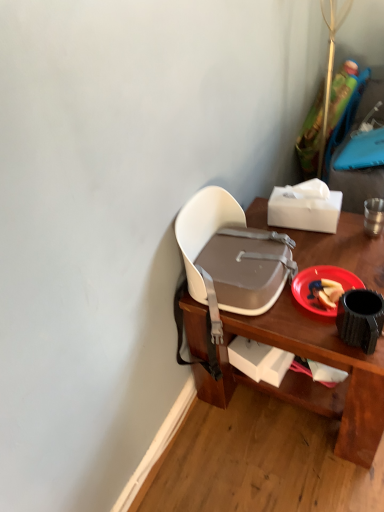
Question: Is white plastic chair at upper center in front of or behind white matte tissue box at upper right, the second box in the bottom-to-top sequence, in the image?

Choices:
 (A) behind
 (B) front

Answer: (B)

Question: Considering the positions of point (347, 424) and point (268, 203), is point (347, 424) closer or farther from the camera than point (268, 203)?

Choices:
 (A) farther
 (B) closer

Answer: (B)

Question: Which object is positioned farthest from the white plastic chair at center?

Choices:
 (A) white matte box at lower center, which ranks as the 1th box in bottom-to-top order
 (B) white matte tissue box at upper right, which is the 1th box from top to bottom
 (C) white plastic chair at upper center
 (D) red plastic plate at lower right

Answer: (B)

Question: Estimate the real-world distances between objects in this image. Which object is farther from the white plastic chair at center?

Choices:
 (A) white plastic chair at upper center
 (B) red plastic plate at lower right
 (C) white matte box at lower center, which ranks as the second box in top-to-bottom order
 (D) white matte tissue box at upper right, the second box in the bottom-to-top sequence

Answer: (D)